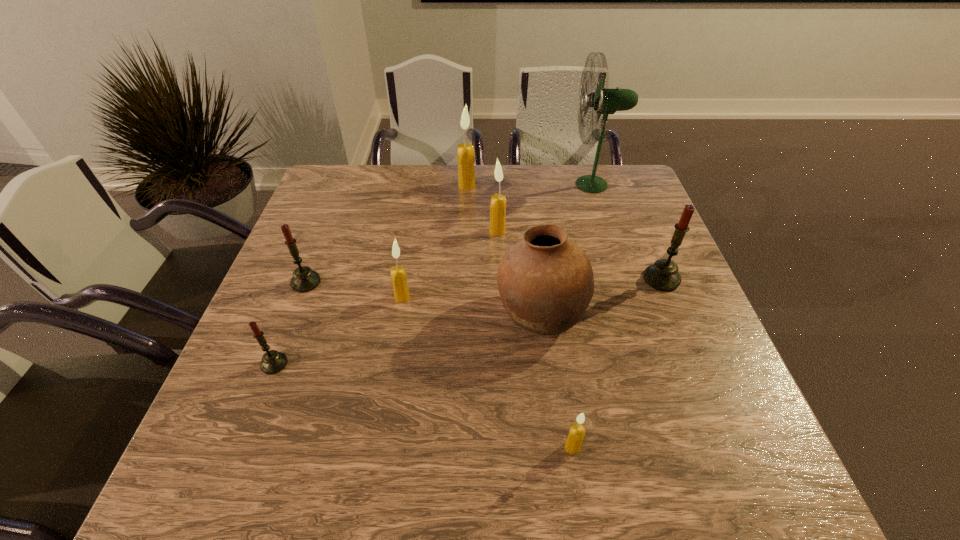
Select which candle is the closest to the pottery. Please provide its 2D coordinates. Your answer should be formatted as a tuple, i.e. [(x, y)], where the tuple contains the x and y coordinates of a point satisfying the conditions above.

[(663, 275)]

Identify the location of candle that stands as the third closest to the seventh nearest object. (663, 275).

Identify which cream candle is located as the third nearest to the biggest cream candle. Please provide its 2D coordinates. Your answer should be formatted as a tuple, i.e. [(x, y)], where the tuple contains the x and y coordinates of a point satisfying the conditions above.

[(573, 443)]

Select which cream candle appears as the closest to the pottery. Please provide its 2D coordinates. Your answer should be formatted as a tuple, i.e. [(x, y)], where the tuple contains the x and y coordinates of a point satisfying the conditions above.

[(498, 201)]

Locate an element on the screen. Image resolution: width=960 pixels, height=540 pixels. red candle that stands as the second closest to the nearest red candle is located at coordinates (663, 275).

At what (x,y) coordinates should I click in order to perform the action: click on red candle that can be found as the third closest to the fan. Please return your answer as a coordinate pair (x, y). This screenshot has height=540, width=960. Looking at the image, I should click on (273, 361).

Identify the location of vacant point that satisfies the following two spatial constraints: 1. on the front side of the third cream candle from left to right; 2. on the left side of the biggest red candle. (499, 279).